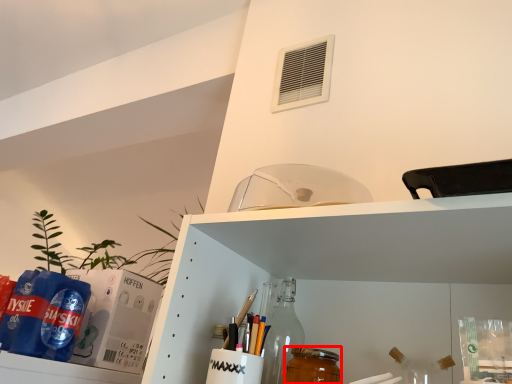
Question: Considering the relative positions of beverage (annotated by the red box) and air conditioning in the image provided, where is beverage (annotated by the red box) located with respect to the staircase?

Choices:
 (A) right
 (B) left

Answer: (B)